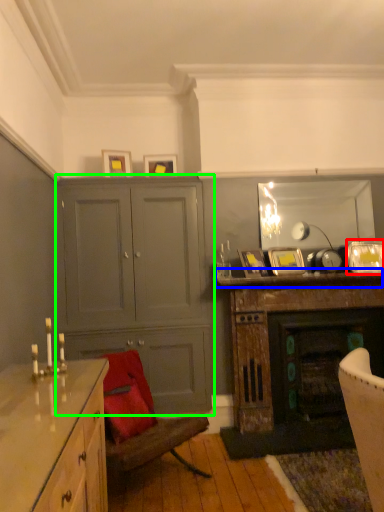
Question: Based on their relative distances, which object is farther from picture frame (highlighted by a red box)? Choose from mantle (highlighted by a blue box) and cabinetry (highlighted by a green box).

Choices:
 (A) mantle
 (B) cabinetry

Answer: (B)